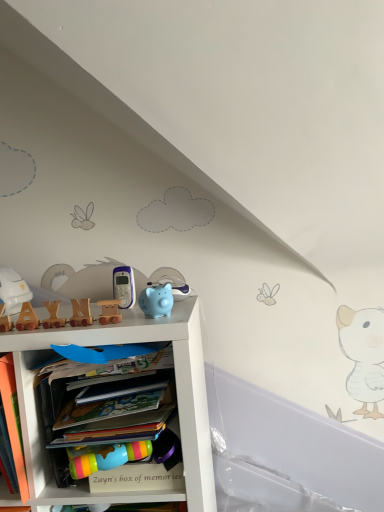
Question: From the image's perspective, is white matte shelf at center located above or below white matte helmet at left, marked as the 7th toy in a right-to-left arrangement?

Choices:
 (A) above
 (B) below

Answer: (B)

Question: From a real-world perspective, is white matte shelf at center physically located above or below white matte helmet at left, marked as the 7th toy in a right-to-left arrangement?

Choices:
 (A) above
 (B) below

Answer: (B)

Question: Which is farther from the white matte helmet at left, positioned as the 1th toy in left-to-right order?

Choices:
 (A) orange matte book at lower left
 (B) white matte shelf at center
 (C) wooden train at center, the fourth toy when ordered from left to right
 (D) wooden letter blocks at upper left, which is the 2th toy in left-to-right order
 (E) wooden train at center, arranged as the fifth toy when viewed from the right

Answer: (B)

Question: Estimate the real-world distances between objects in this image. Which object is closer to the white matte helmet at left, marked as the 7th toy in a right-to-left arrangement?

Choices:
 (A) matte plastic phone at center, the sixth toy viewed from the left
 (B) wooden letter blocks at upper left, which is the 2th toy in left-to-right order
 (C) orange matte book at lower left
 (D) wooden train at center, which appears as the 5th toy when viewed from the left
 (E) matte blue piggy bank at center, positioned as the first toy in right-to-left order

Answer: (B)